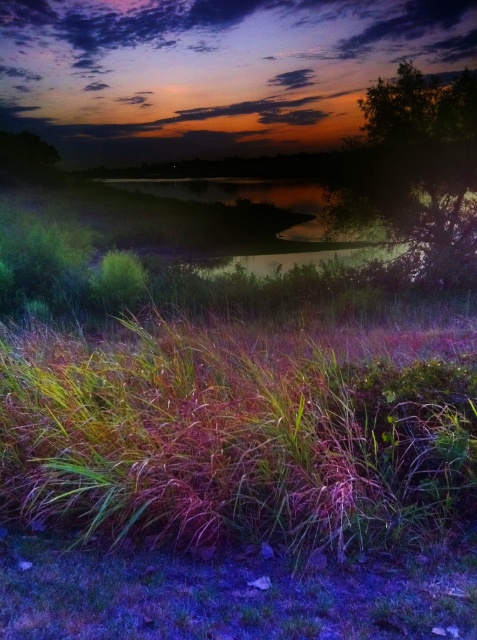
Question: Which point is closer to the camera?

Choices:
 (A) green leafy tree at upper right
 (B) green leafy tree at upper left

Answer: (A)

Question: Is green leafy tree at upper right thinner than green leafy tree at upper left?

Choices:
 (A) no
 (B) yes

Answer: (B)

Question: Can you confirm if green leafy tree at upper right is positioned to the right of green leafy tree at upper left?

Choices:
 (A) yes
 (B) no

Answer: (A)

Question: In this image, where is green leafy tree at upper right located relative to green leafy tree at upper left?

Choices:
 (A) above
 (B) below

Answer: (B)